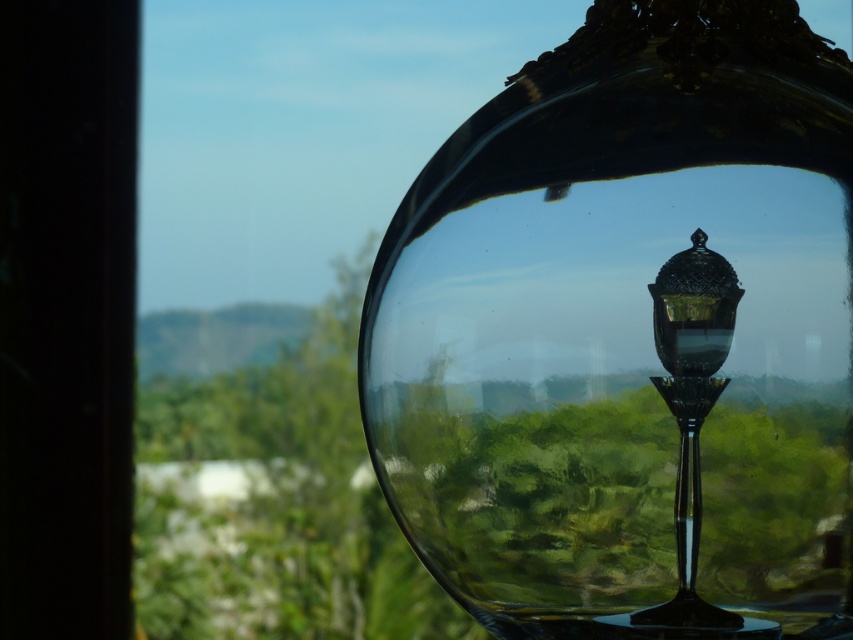
Between transparent glass bowl at center and green leafy tree at center, which one has more height?

With more height is transparent glass bowl at center.

Consider the image. Can you confirm if transparent glass bowl at center is positioned above green leafy tree at center?

Yes, transparent glass bowl at center is above green leafy tree at center.

Between point (515, 548) and point (132, 556), which one is positioned behind?

The point (132, 556) is more distant.

Where is `transparent glass bowl at center`? Image resolution: width=853 pixels, height=640 pixels. transparent glass bowl at center is located at coordinates (630, 333).

What do you see at coordinates (630, 333) in the screenshot? The image size is (853, 640). I see `transparent glass bowl at center` at bounding box center [630, 333].

Which is below, transparent glass bowl at center or black glass lamp post at center?

Positioned lower is black glass lamp post at center.

Which is in front, point (538, 376) or point (724, 621)?

Positioned in front is point (538, 376).

Identify the location of transparent glass bowl at center. Image resolution: width=853 pixels, height=640 pixels. pyautogui.click(x=630, y=333).

The image size is (853, 640). Describe the element at coordinates (270, 483) in the screenshot. I see `green leafy tree at center` at that location.

The width and height of the screenshot is (853, 640). What are the coordinates of `green leafy tree at center` in the screenshot? It's located at (270, 483).